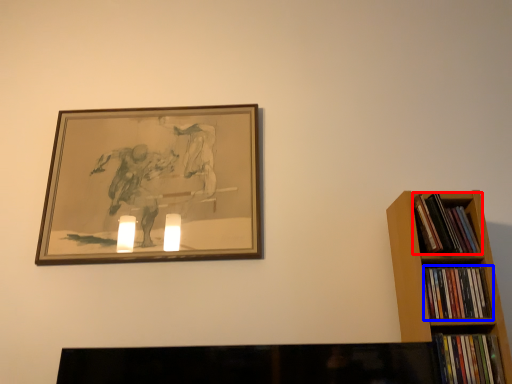
Question: Among these objects, which one is nearest to the camera, book (highlighted by a red box) or book (highlighted by a blue box)?

Choices:
 (A) book
 (B) book

Answer: (B)